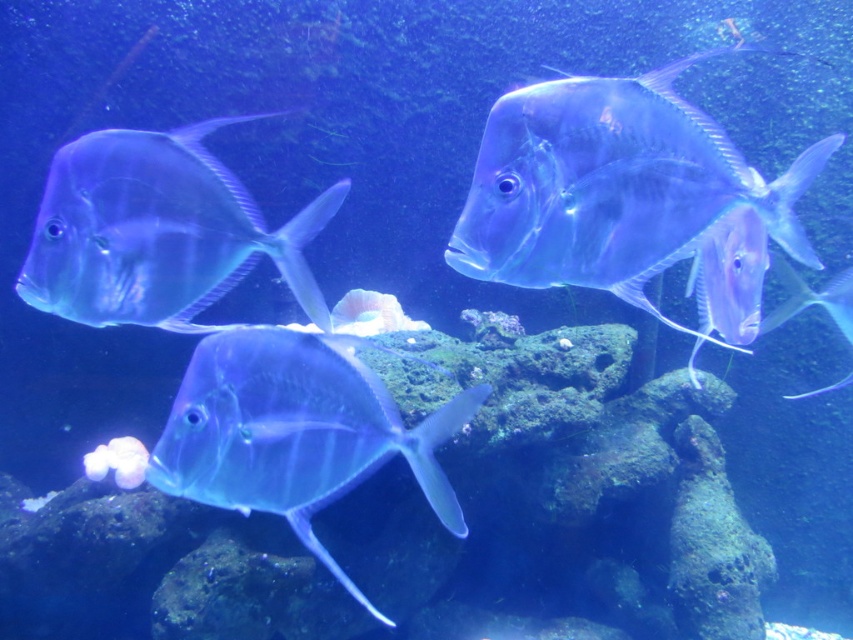
Does translucent blue fish at left have a lesser width compared to translucent glassy fish at right?

No, translucent blue fish at left is not thinner than translucent glassy fish at right.

Identify the location of translucent blue fish at left. (157, 230).

Can you confirm if translucent glass fish at upper center is wider than translucent glassy fish at right?

Yes.

Between point (741, 188) and point (759, 330), which one is positioned in front?

Point (741, 188) is in front.

What are the coordinates of `translucent glass fish at upper center` in the screenshot? It's located at (628, 196).

Is point (579, 106) positioned after point (329, 464)?

No, (579, 106) is in front of (329, 464).

Who is positioned more to the right, translucent glass fish at upper center or translucent glass fish at center?

From the viewer's perspective, translucent glass fish at upper center appears more on the right side.

Between point (527, 284) and point (161, 451), which one is positioned behind?

The point (161, 451) is more distant.

Find the location of a particular element. Image resolution: width=853 pixels, height=640 pixels. translucent glass fish at upper center is located at coordinates (628, 196).